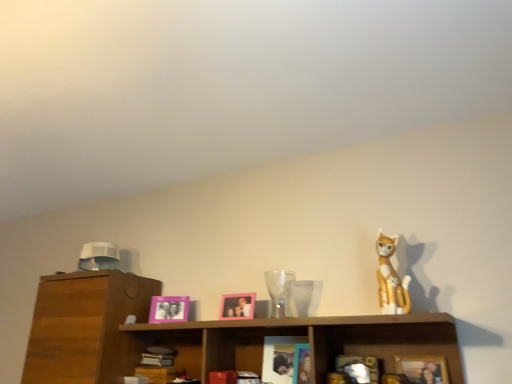
You are a GUI agent. You are given a task and a screenshot of the screen. Output one action in this format:
    pyautogui.click(x=<x>, y=<y>)
    Task: Click on the vacant space in between pink plastic picture frame at center, the second picture frame when ordered from left to right, and transparent glass vase at center
    The image size is (512, 384).
    Given the screenshot: What is the action you would take?
    pyautogui.click(x=246, y=322)